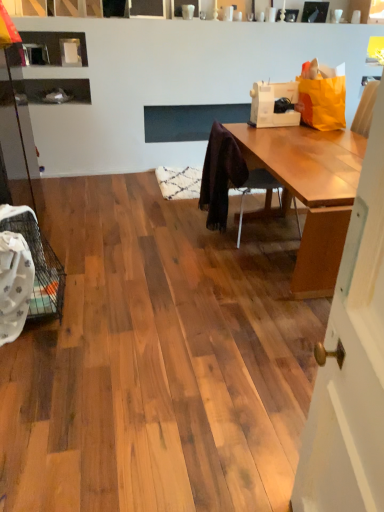
Question: Is white plastic sewing machine at upper right wider or thinner than wooden chair at center?

Choices:
 (A) wide
 (B) thin

Answer: (B)

Question: From their relative heights in the image, would you say white plastic sewing machine at upper right is taller or shorter than wooden chair at center?

Choices:
 (A) tall
 (B) short

Answer: (B)

Question: From the image's perspective, is white plastic sewing machine at upper right positioned above or below wooden chair at center?

Choices:
 (A) above
 (B) below

Answer: (A)

Question: Relative to white plastic sewing machine at upper right, is wooden chair at center in front or behind?

Choices:
 (A) behind
 (B) front

Answer: (B)

Question: Would you say wooden chair at center is inside or outside white plastic sewing machine at upper right?

Choices:
 (A) outside
 (B) inside

Answer: (A)

Question: Does point (221, 186) appear closer or farther from the camera than point (296, 82)?

Choices:
 (A) farther
 (B) closer

Answer: (B)

Question: Is wooden chair at center bigger or smaller than white plastic sewing machine at upper right?

Choices:
 (A) small
 (B) big

Answer: (B)